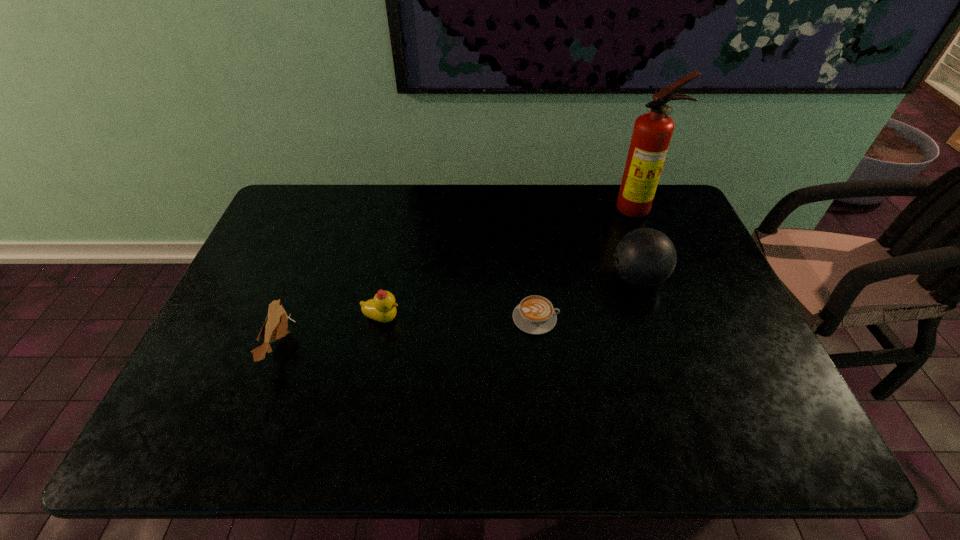
Locate an element on the screen. The width and height of the screenshot is (960, 540). vacant region at the far edge is located at coordinates (519, 207).

The height and width of the screenshot is (540, 960). What are the coordinates of `free space at the near edge of the desktop` in the screenshot? It's located at (259, 424).

This screenshot has width=960, height=540. What are the coordinates of `vacant space at the left edge of the desktop` in the screenshot? It's located at (288, 270).

Find the location of a particular element. free region at the far left corner of the desktop is located at coordinates (289, 208).

In the image, there is a desktop. Find the location of `vacant space at the near left corner`. vacant space at the near left corner is located at coordinates (218, 423).

I want to click on vacant area between the bird and the tallest object, so click(459, 276).

The image size is (960, 540). I want to click on vacant space that is in between the bird and the second object from left to right, so click(331, 332).

You are a GUI agent. You are given a task and a screenshot of the screen. Output one action in this format:
    pyautogui.click(x=<x>, y=<y>)
    Task: Click on the free point between the second object from left to right and the third object from left to right
    
    Given the screenshot: What is the action you would take?
    pyautogui.click(x=459, y=318)

At what (x,y) coordinates should I click in order to perform the action: click on vacant space that is in between the farthest object and the third object from right to left. Please return your answer as a coordinate pair (x, y). Looking at the image, I should click on (587, 264).

Where is `free area in between the second object from left to right and the bowling ball`? free area in between the second object from left to right and the bowling ball is located at coordinates (510, 298).